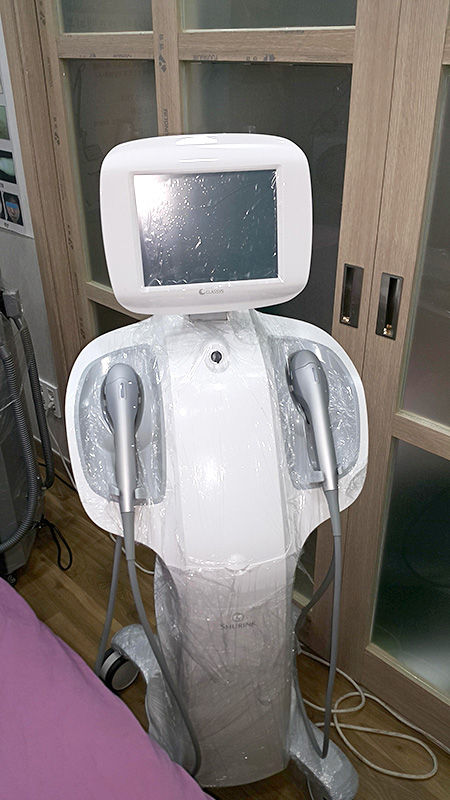
I want to click on wooden doors, so click(x=358, y=202), click(x=395, y=212).